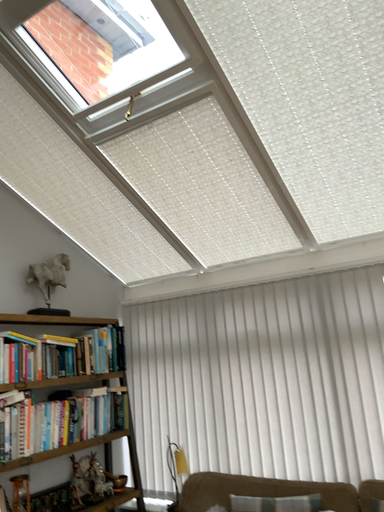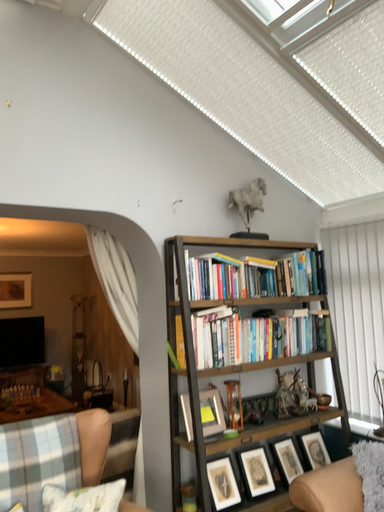
Question: Which way did the camera rotate in the video?

Choices:
 (A) rotated downward
 (B) rotated upward

Answer: (A)